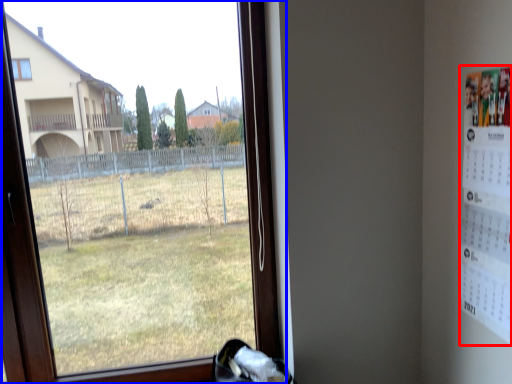
Question: Which object appears closest to the camera in this image, poster (highlighted by a red box) or window (highlighted by a blue box)?

Choices:
 (A) poster
 (B) window

Answer: (A)